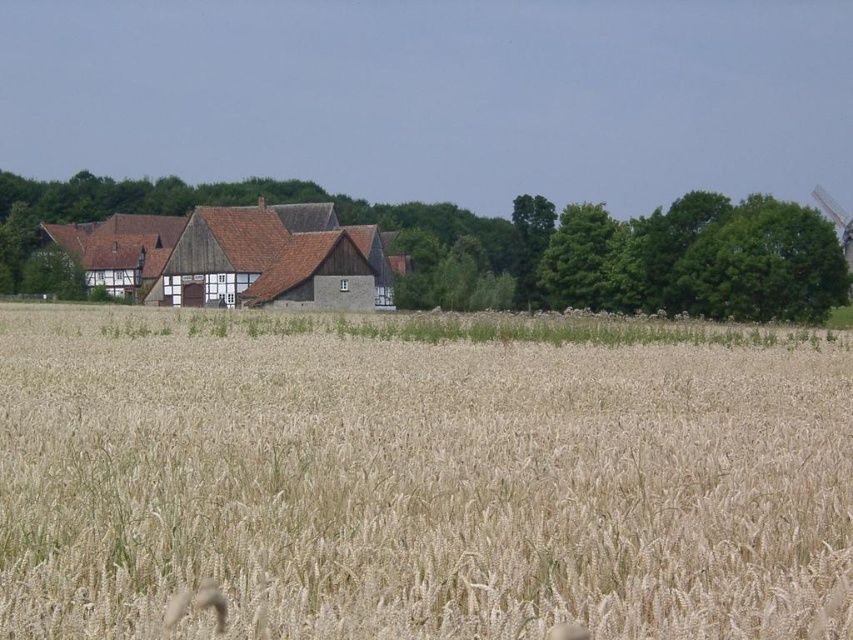
Does point (134, 388) come farther from viewer compared to point (123, 262)?

No, (134, 388) is in front of (123, 262).

Between golden wheat field at center and brown wooden barn at center, which one appears on the right side from the viewer's perspective?

Positioned to the right is golden wheat field at center.

Who is more distant from viewer, (543, 385) or (201, 266)?

The point (201, 266) is more distant.

Find the location of a particular element. Image resolution: width=853 pixels, height=640 pixels. golden wheat field at center is located at coordinates (421, 476).